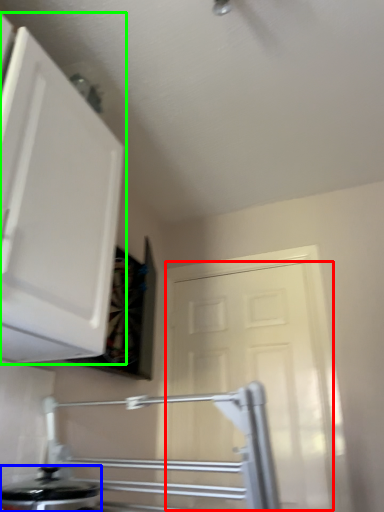
Question: Which object is the farthest from door (highlighted by a red box)? Choose among these: kitchen appliance (highlighted by a blue box) or cabinetry (highlighted by a green box).

Choices:
 (A) kitchen appliance
 (B) cabinetry

Answer: (B)